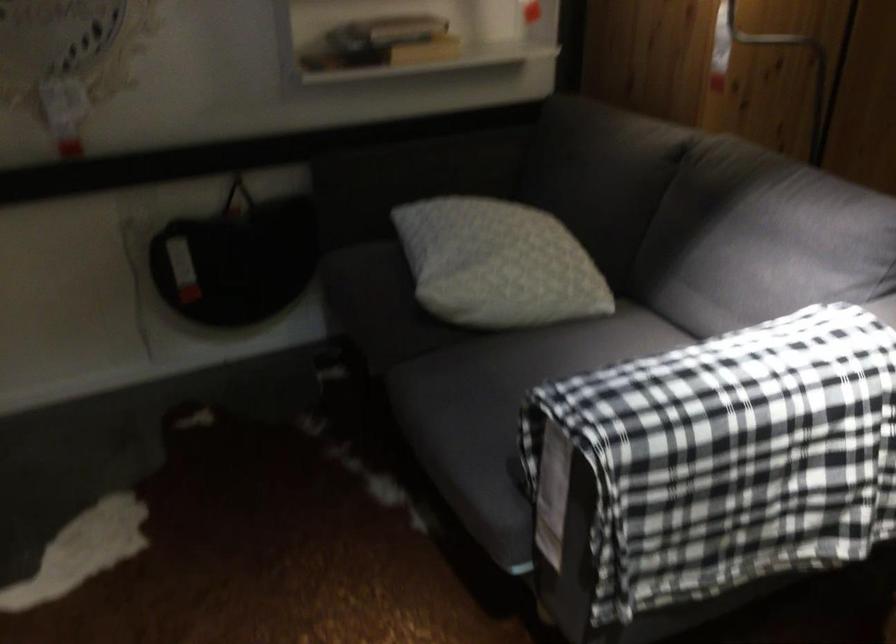
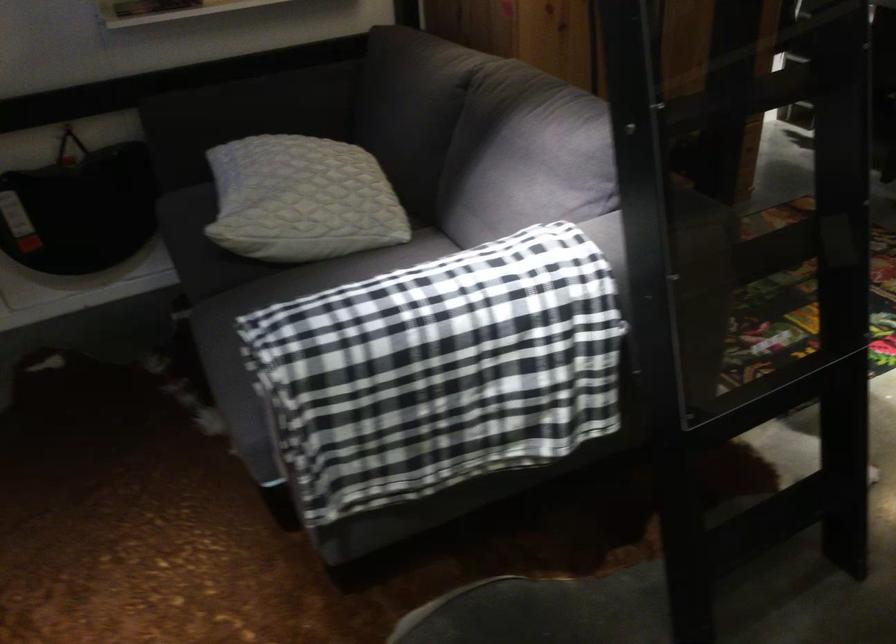
Question: The images are taken continuously from a first-person perspective. In which direction is your viewpoint rotating?

Choices:
 (A) Left
 (B) Right
 (C) Up
 (D) Down

Answer: (D)